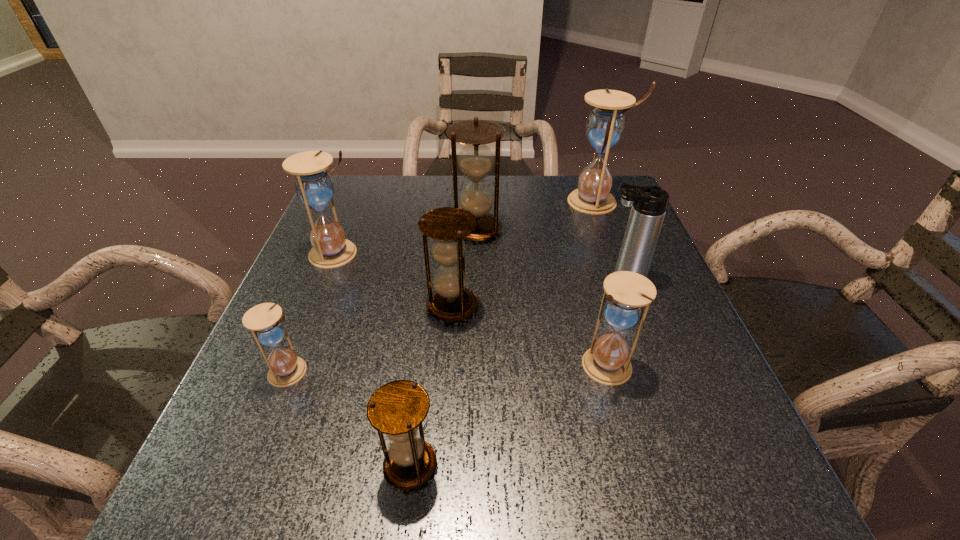
At what (x,y) coordinates should I click in order to perform the action: click on vacant area between the smallest white hourglass and the third nearest white hourglass. Please return your answer as a coordinate pair (x, y). Image resolution: width=960 pixels, height=540 pixels. Looking at the image, I should click on (314, 313).

This screenshot has height=540, width=960. Identify the location of vacant space in between the second farthest brown hourglass and the smallest white hourglass. (x=372, y=339).

You are a GUI agent. You are given a task and a screenshot of the screen. Output one action in this format:
    pyautogui.click(x=<x>, y=<y>)
    Task: Click on the vacant point located between the nearest object and the biggest brown hourglass
    Image resolution: width=960 pixels, height=540 pixels.
    Given the screenshot: What is the action you would take?
    pyautogui.click(x=444, y=347)

I want to click on vacant area that lies between the third nearest white hourglass and the farthest brown hourglass, so click(406, 241).

Find the location of a particular element. The width and height of the screenshot is (960, 540). free space between the second smallest white hourglass and the farthest object is located at coordinates (602, 284).

Identify the location of free spot between the second farthest white hourglass and the smallest brown hourglass. (373, 359).

Find the location of a particular element. The image size is (960, 540). vacant area between the second farthest white hourglass and the smallest brown hourglass is located at coordinates (373, 359).

In order to click on free space between the farthest object and the nearest hourglass in this screenshot , I will do `click(504, 333)`.

Identify the location of the third closest object to the farthest object. Image resolution: width=960 pixels, height=540 pixels. (451, 301).

At what (x,y) coordinates should I click in order to perform the action: click on object identified as the fourth closest to the tallest hourglass. Please return your answer as a coordinate pair (x, y). The width and height of the screenshot is (960, 540). Looking at the image, I should click on (607, 362).